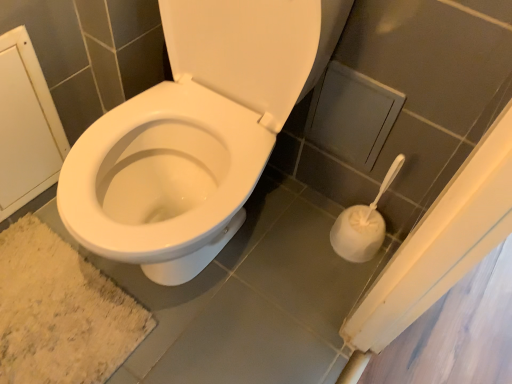
Question: Looking at their shapes, would you say white matte toilet brush at lower right is wider or thinner than beige shaggy bath mat at lower left?

Choices:
 (A) wide
 (B) thin

Answer: (B)

Question: Is white matte toilet brush at lower right taller or shorter than beige shaggy bath mat at lower left?

Choices:
 (A) short
 (B) tall

Answer: (B)

Question: From a real-world perspective, is white matte toilet brush at lower right physically located above or below beige shaggy bath mat at lower left?

Choices:
 (A) above
 (B) below

Answer: (A)

Question: Is beige shaggy bath mat at lower left to the left or to the right of white matte toilet brush at lower right in the image?

Choices:
 (A) right
 (B) left

Answer: (B)

Question: Is point (0, 317) closer or farther from the camera than point (379, 190)?

Choices:
 (A) closer
 (B) farther

Answer: (A)

Question: Is beige shaggy bath mat at lower left in front of or behind white matte toilet brush at lower right in the image?

Choices:
 (A) front
 (B) behind

Answer: (B)

Question: From a real-world perspective, relative to white matte toilet brush at lower right, is beige shaggy bath mat at lower left vertically above or below?

Choices:
 (A) above
 (B) below

Answer: (B)